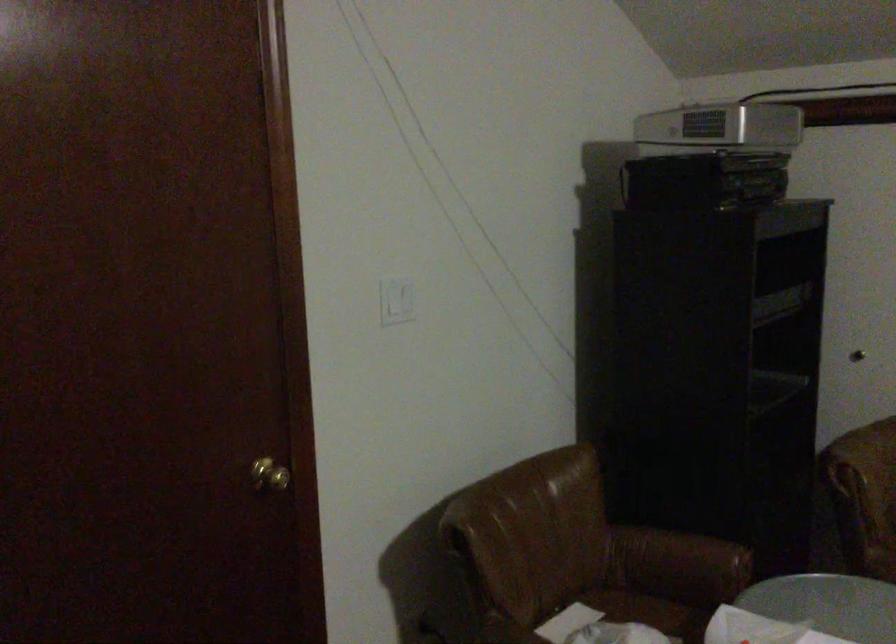
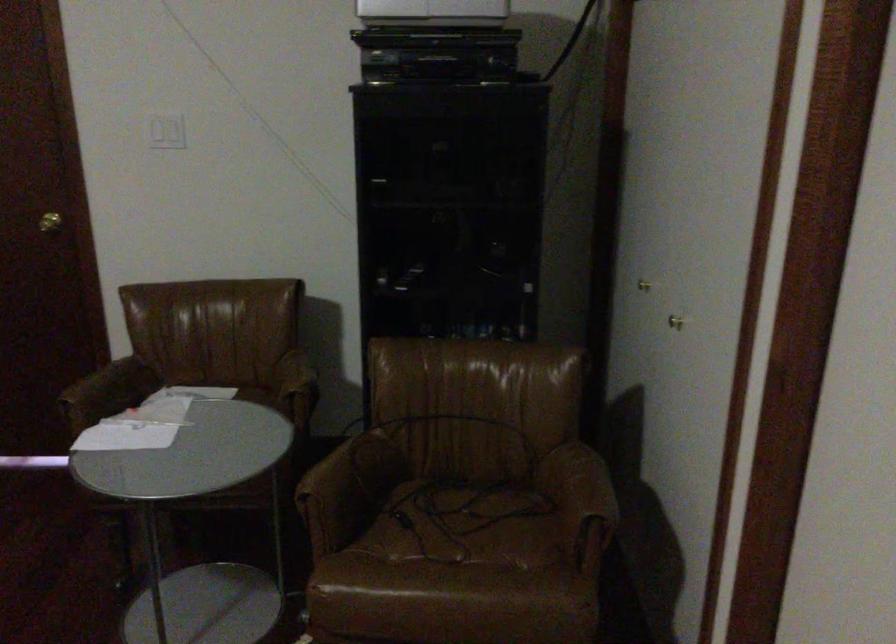
Locate, in the second image, the point that corresponds to the point at 304,484 in the first image.

(49, 222)